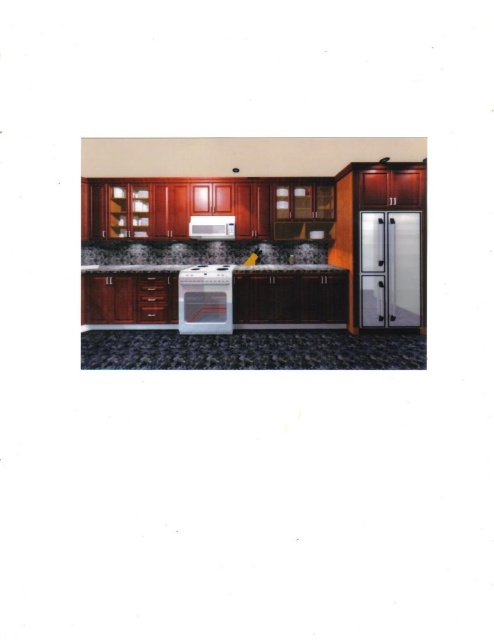
How much distance is there between satin stainless steel refrigerator at right and satin white microwave at center?

satin stainless steel refrigerator at right and satin white microwave at center are 7.59 feet apart.

Is point (404, 257) farther from viewer compared to point (201, 225)?

No, it is not.

What do you see at coordinates (389, 268) in the screenshot? I see `satin stainless steel refrigerator at right` at bounding box center [389, 268].

Find the location of `satin stainless steel refrigerator at right`. satin stainless steel refrigerator at right is located at coordinates (389, 268).

Is satin silver dishwasher at center below granite countertop at center?

Correct, satin silver dishwasher at center is located below granite countertop at center.

Can you confirm if satin silver dishwasher at center is thinner than granite countertop at center?

Yes.

What do you see at coordinates (205, 300) in the screenshot? I see `satin silver dishwasher at center` at bounding box center [205, 300].

At what (x,y) coordinates should I click in order to perform the action: click on satin silver dishwasher at center. Please return your answer as a coordinate pair (x, y). This screenshot has height=640, width=494. Looking at the image, I should click on (205, 300).

Is satin stainless steel refrigerator at right to the left of granite countertop at center from the viewer's perspective?

No, satin stainless steel refrigerator at right is not to the left of granite countertop at center.

Can you confirm if satin stainless steel refrigerator at right is positioned to the right of granite countertop at center?

Indeed, satin stainless steel refrigerator at right is positioned on the right side of granite countertop at center.

In order to click on satin stainless steel refrigerator at right in this screenshot , I will do `click(389, 268)`.